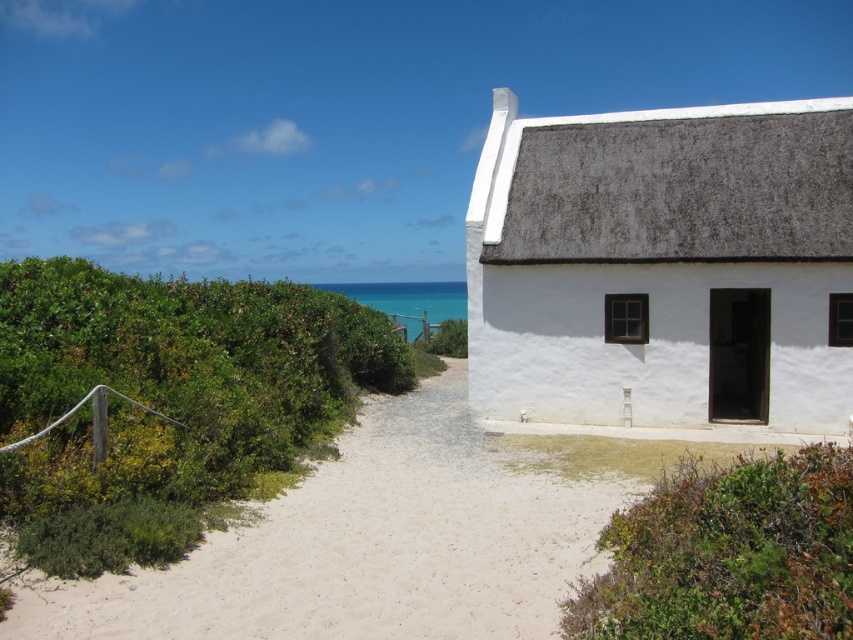
Between white sandy path at center and green leafy bush at lower right, which one appears on the right side from the viewer's perspective?

Positioned to the right is green leafy bush at lower right.

Can you confirm if white sandy path at center is positioned to the right of green leafy bush at lower right?

No, white sandy path at center is not to the right of green leafy bush at lower right.

Which is behind, point (323, 582) or point (659, 508)?

Point (659, 508)

Where is `white sandy path at center`? The image size is (853, 640). white sandy path at center is located at coordinates (364, 547).

Is white thatch roofed cottage at upper right smaller than green leafy bush at left?

Correct, white thatch roofed cottage at upper right occupies less space than green leafy bush at left.

Is white thatch roofed cottage at upper right positioned behind green leafy bush at left?

Yes.

Who is more distant from viewer, (675,212) or (265,324)?

The point (675,212) is behind.

Identify the location of white thatch roofed cottage at upper right. (664, 266).

The height and width of the screenshot is (640, 853). What do you see at coordinates (664, 266) in the screenshot?
I see `white thatch roofed cottage at upper right` at bounding box center [664, 266].

Can you confirm if white thatch roofed cottage at upper right is positioned above green leafy bush at lower right?

Yes.

Describe the element at coordinates (664, 266) in the screenshot. I see `white thatch roofed cottage at upper right` at that location.

Locate an element on the screen. white thatch roofed cottage at upper right is located at coordinates (664, 266).